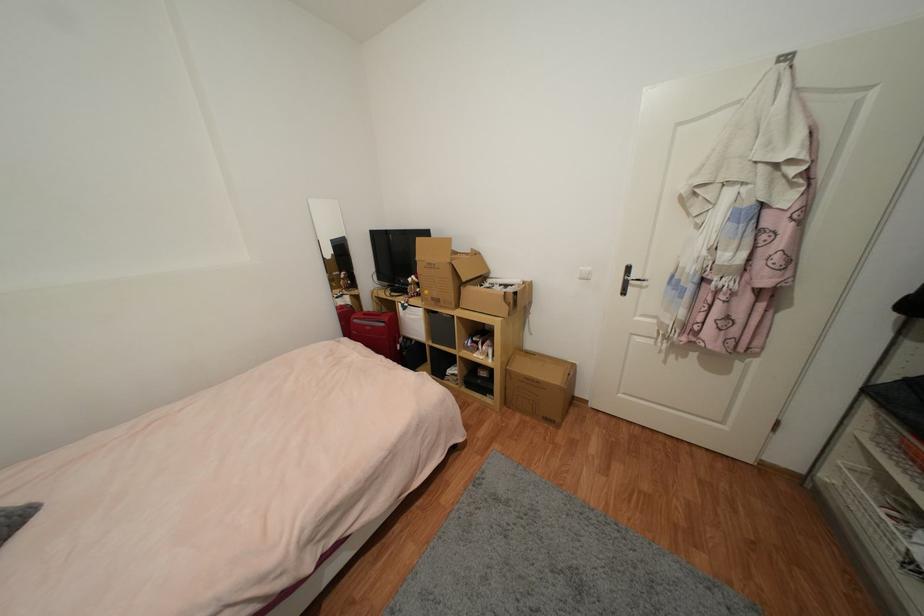
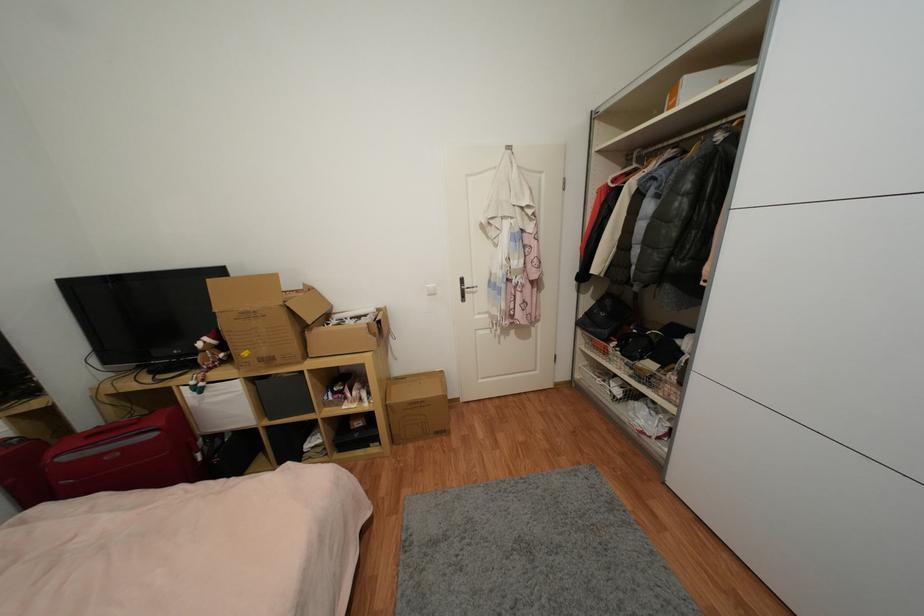
In the second image, find the point that corresponds to point (386, 326) in the first image.

(157, 436)